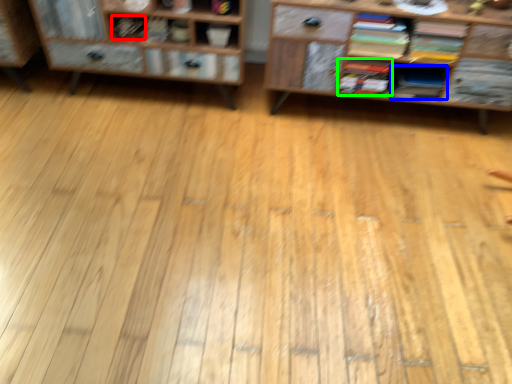
Question: Which is farther away from book (highlighted by a red box)? book (highlighted by a blue box) or book (highlighted by a green box)?

Choices:
 (A) book
 (B) book

Answer: (A)